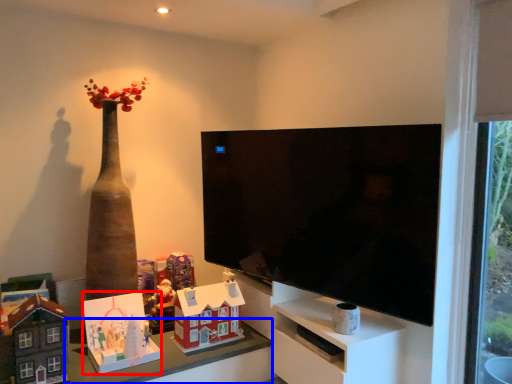
Question: Which of the following is the closest to the observer, toy (highlighted by a red box) or table (highlighted by a blue box)?

Choices:
 (A) toy
 (B) table

Answer: (B)